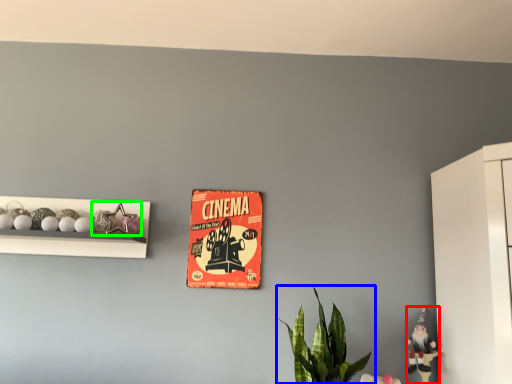
Question: Considering the real-world distances, which object is farthest from toy (highlighted by a red box)? houseplant (highlighted by a blue box) or toy (highlighted by a green box)?

Choices:
 (A) houseplant
 (B) toy

Answer: (B)